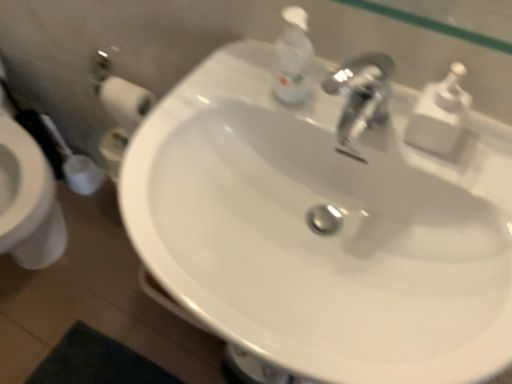
Locate an element on the screen. This screenshot has width=512, height=384. vacant area in front of white plastic soap dispenser at upper right, the second soap dispenser in the left-to-right sequence is located at coordinates (460, 178).